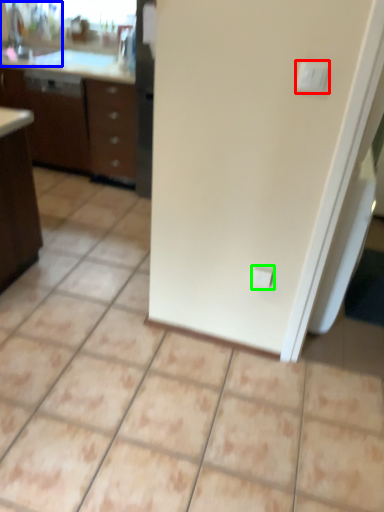
Question: Which object is the closest to the light switch (highlighted by a red box)? Choose among these: sink (highlighted by a blue box) or electric outlet (highlighted by a green box).

Choices:
 (A) sink
 (B) electric outlet

Answer: (B)